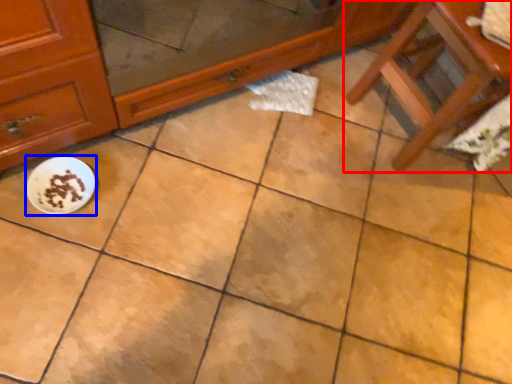
Question: Which of the following is the farthest to the observer, furniture (highlighted by a red box) or meal (highlighted by a blue box)?

Choices:
 (A) furniture
 (B) meal

Answer: (B)